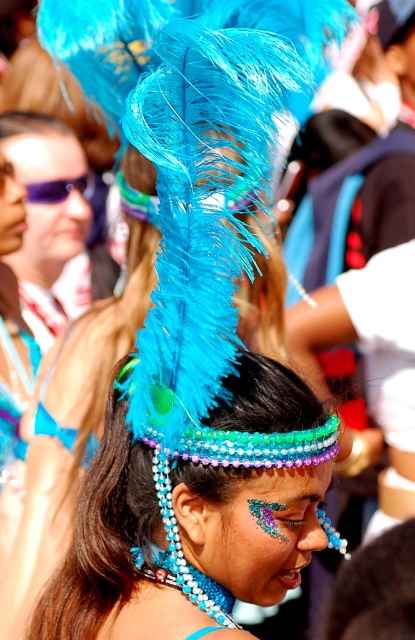
Question: Does shiny blue feathers at center have a smaller size compared to sunglasses at upper left?

Choices:
 (A) yes
 (B) no

Answer: (B)

Question: Can you confirm if shiny blue feathers at center is positioned above sunglasses at upper left?

Choices:
 (A) no
 (B) yes

Answer: (A)

Question: Which object is positioned closest to the shiny blue feathers at center?

Choices:
 (A) sunglasses at upper left
 (B) shiny blue feather headdress at center

Answer: (B)

Question: Can you confirm if shiny blue feather headdress at center is positioned below sunglasses at upper left?

Choices:
 (A) yes
 (B) no

Answer: (A)

Question: Estimate the real-world distances between objects in this image. Which object is closer to the sunglasses at upper left?

Choices:
 (A) shiny blue feather headdress at center
 (B) shiny blue feathers at center

Answer: (B)

Question: Which of the following is the closest to the observer?

Choices:
 (A) sunglasses at upper left
 (B) shiny blue feathers at center
 (C) shiny blue feather headdress at center

Answer: (C)